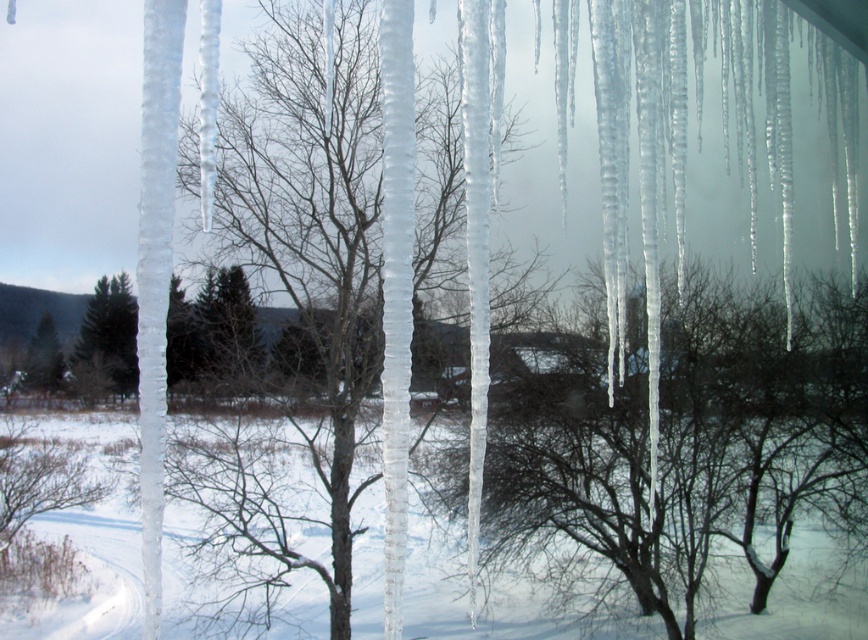
You are an environmental scientist observing the winter scene. You notice two trees at the center of the image. One is labeled as the transparent ice tree at center and the other as the green matte tree at center. Based on the scene description, which tree has a greater width?

The transparent ice tree at center has a greater width than the green matte tree at center according to the description.

You are standing in the winter scene and notice both the translucent ice at center and the green matte evergreen tree at center. Which object is positioned to the right when facing the scene?

The translucent ice at center is to the right of the green matte evergreen tree at center, so it is positioned to the right when facing the scene.

You are an artist planning to paint the winter scene. You want to ensure the transparent ice tree at center and the green matte tree at center are proportionally accurate. Which tree should you draw larger in your painting?

The transparent ice tree at center should be drawn larger than the green matte tree at center because it has a larger size according to the description.